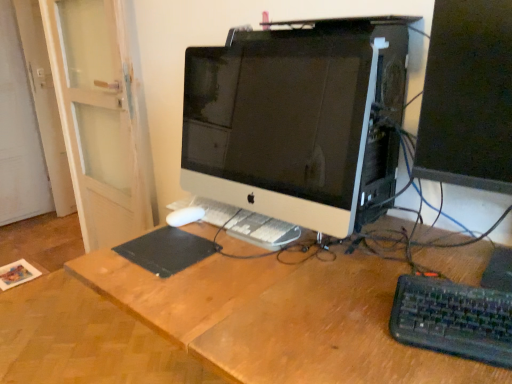
Locate an element on the screen. Image resolution: width=512 pixels, height=384 pixels. blank space situated above wooden desk at center (from a real-world perspective) is located at coordinates click(x=296, y=268).